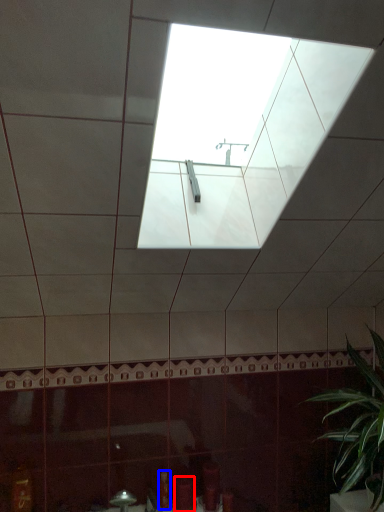
Question: Which of the following is the closest to the observer, toiletry (highlighted by a red box) or toiletry (highlighted by a blue box)?

Choices:
 (A) toiletry
 (B) toiletry

Answer: (A)